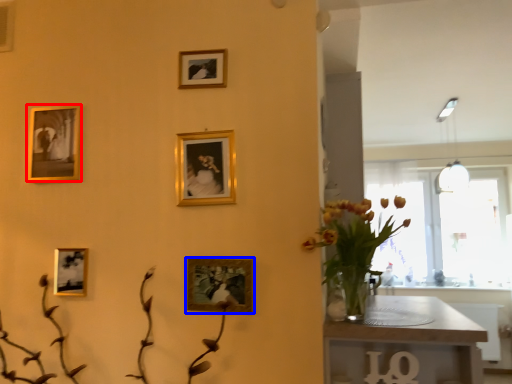
Question: Which point is closer to the camera, picture frame (highlighted by a red box) or picture frame (highlighted by a blue box)?

Choices:
 (A) picture frame
 (B) picture frame

Answer: (B)